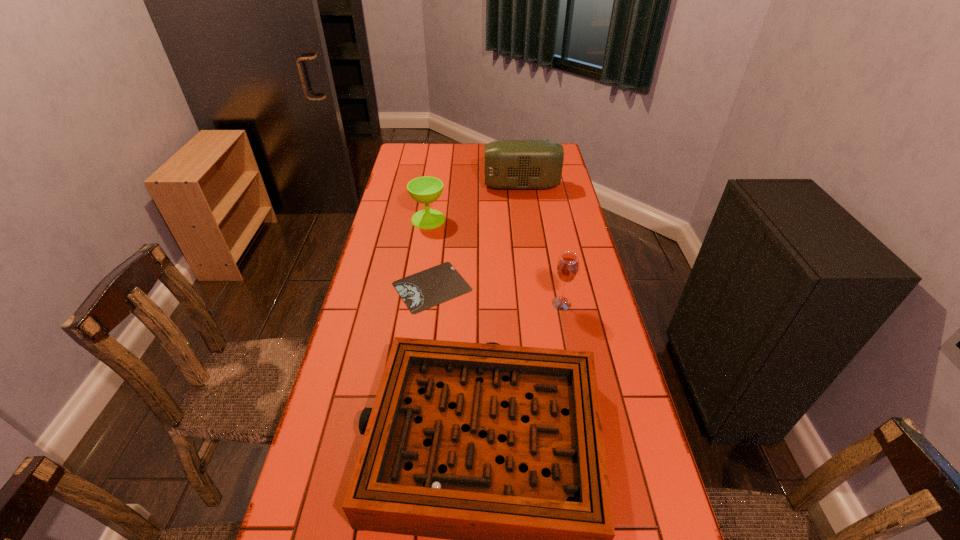
Identify the location of vacant region located on the front of the third tallest object. Image resolution: width=960 pixels, height=540 pixels. (419, 286).

Identify the location of vacant region located on the front of the shortest object. (427, 329).

Find the location of a particular element. Image resolution: width=960 pixels, height=540 pixels. wineglass that is positioned at the left edge is located at coordinates (426, 189).

I want to click on mousepad that is at the left edge, so click(x=420, y=291).

Find the location of a particular element. radio_receiver situated at the right edge is located at coordinates (509, 164).

At what (x,y) coordinates should I click in order to perform the action: click on wineglass at the right edge. Please return your answer as a coordinate pair (x, y). This screenshot has width=960, height=540. Looking at the image, I should click on (567, 268).

In the image, there is a desktop. At what (x,y) coordinates should I click in order to perform the action: click on free space at the far edge. Please return your answer as a coordinate pair (x, y). The image size is (960, 540). Looking at the image, I should click on point(441,146).

Identify the location of vacant region at the left edge of the desktop. pos(377,253).

Find the location of a particular element. This screenshot has width=960, height=540. vacant area at the right edge is located at coordinates (546, 202).

This screenshot has width=960, height=540. What are the coordinates of `vacant space at the far left corner of the desktop` in the screenshot? It's located at (407, 144).